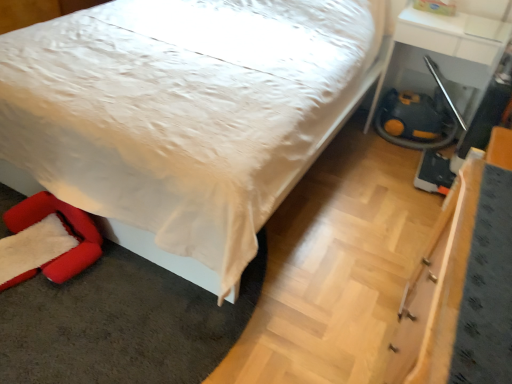
Where is `free space to the right of velvet red swivel chair at lower left`? The image size is (512, 384). free space to the right of velvet red swivel chair at lower left is located at coordinates (x=121, y=297).